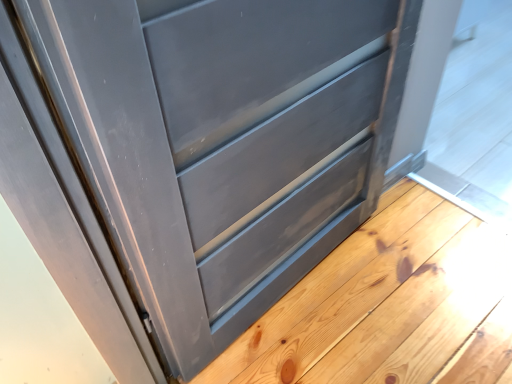
Where is `matte gray plywood at lower center`? matte gray plywood at lower center is located at coordinates (388, 304).

The width and height of the screenshot is (512, 384). Describe the element at coordinates (388, 304) in the screenshot. I see `matte gray plywood at lower center` at that location.

Consider the image. Measure the distance between point (410, 238) and camera.

Point (410, 238) is 1.38 meters away from camera.

At what (x,y) coordinates should I click in order to perform the action: click on matte gray plywood at lower center. Please return your answer as a coordinate pair (x, y). Looking at the image, I should click on (388, 304).